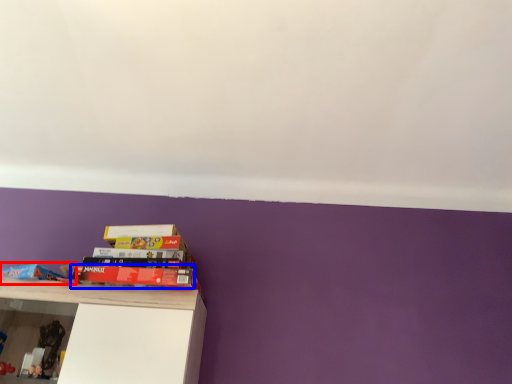
Question: Which point is closer to the camera, book (highlighted by a red box) or book (highlighted by a blue box)?

Choices:
 (A) book
 (B) book

Answer: (A)